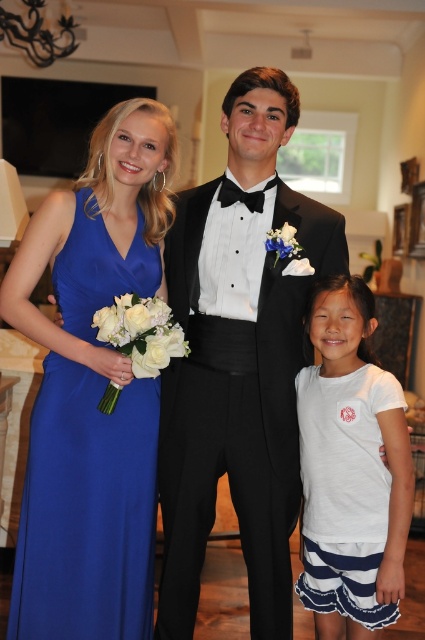
You are a photographer setting up for a formal portrait. You have two subjects wearing the black satin tuxedo at center and the royal blue satin dress at left. You need to adjust the camera height to ensure both are framed properly. Since one is much taller than the other, which subject should you focus on to maintain balance in the composition?

The black satin tuxedo at center is much taller than the royal blue satin dress at left, so you should focus on the black satin tuxedo at center to maintain balance in the composition.

In the scene shown: You are a photographer adjusting the camera settings for a portrait. The subjects are the royal blue satin dress at left and the white cotton shirt at center. The minimum focus distance of your camera is 26 inches. Can you focus on both subjects without adjusting your position?

The royal blue satin dress at left and white cotton shirt at center are 26.28 inches apart from each other. Since the minimum focus distance is 26 inches, the camera can focus on both subjects as the distance between them is slightly more than the required minimum focus distance.

You are a photographer setting up for a formal portrait. You have a 3ft wide backdrop that needs to cover the entire width of the black satin tuxedo at center and the royal blue satin dress at left. Based on their widths, will the backdrop be sufficient to cover both?

The black satin tuxedo at center is wider than the royal blue satin dress at left. Since the backdrop is 3ft wide, it should be sufficient to cover both as the tuxedo is the wider of the two and the total combined width would likely not exceed 3ft unless they are positioned side by side taking up the full width.